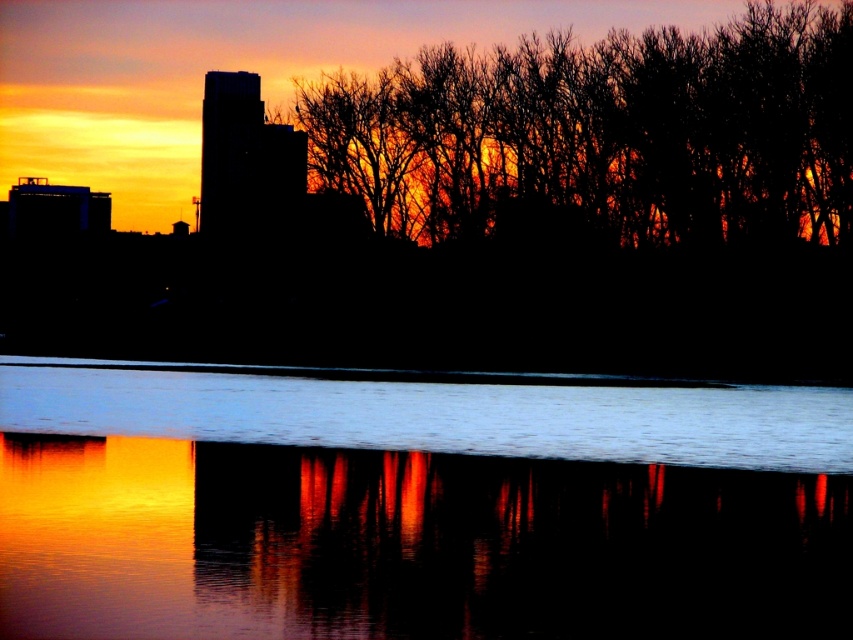
Between smooth glass water at center and silhouette bare trees at upper center, which one appears on the left side from the viewer's perspective?

From the viewer's perspective, smooth glass water at center appears more on the left side.

Can you confirm if smooth glass water at center is positioned to the left of silhouette bare trees at upper center?

Indeed, smooth glass water at center is positioned on the left side of silhouette bare trees at upper center.

This screenshot has height=640, width=853. Describe the element at coordinates (416, 504) in the screenshot. I see `smooth glass water at center` at that location.

Identify the location of smooth glass water at center. The image size is (853, 640). tap(416, 504).